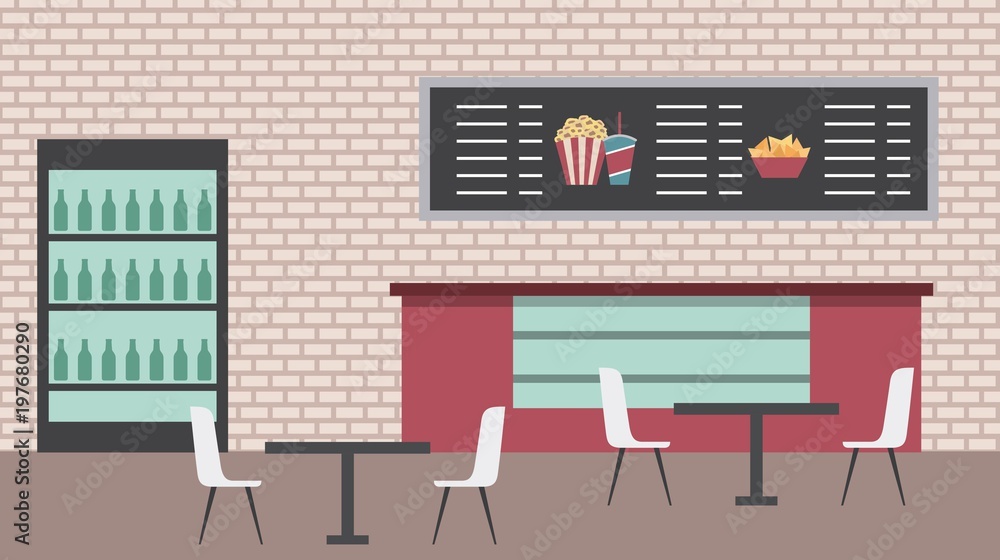
Where is `chairs`? chairs is located at coordinates (475, 472), (633, 455).